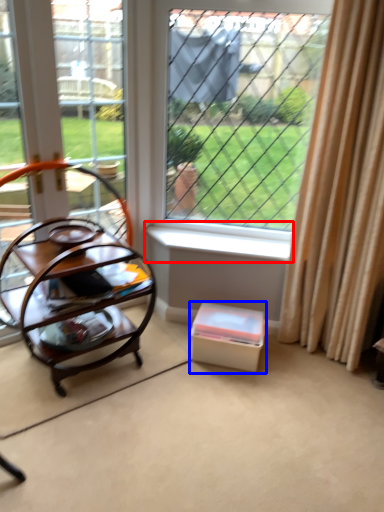
Question: Which object is closer to the camera taking this photo, window sill (highlighted by a red box) or storage box (highlighted by a blue box)?

Choices:
 (A) window sill
 (B) storage box

Answer: (B)